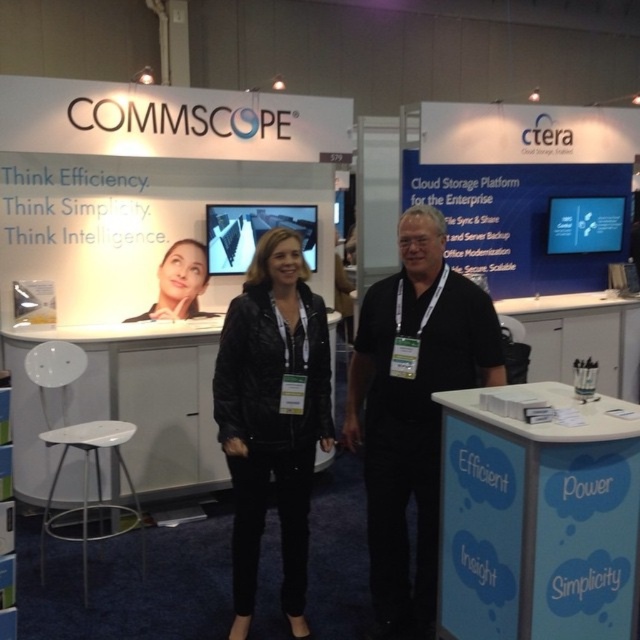
In the scene shown: You are organizing an event and need to place a large banner on the white plastic desk at center and the matte black jacket at center. Which object can accommodate the banner without folding it?

The white plastic desk at center is bigger than the matte black jacket at center, so the banner can be placed on the white plastic desk at center without folding.

You are attending a trade show and want to find the Commscope booth. You see a black leather jacket at center. Where exactly is the black leather jacket located in terms of coordinates?

The black leather jacket at center is located at coordinates point (273, 416).

You are a trade show attendee who wants to sit down while looking at the black leather jacket at center. There is a white plastic stool at lower left. Can you comfortably sit on the stool while still being able to see the jacket?

The black leather jacket at center is 38.73 inches from the white plastic stool at lower left. Since the distance is about 3.2 feet, you can comfortably sit on the stool and still see the jacket.